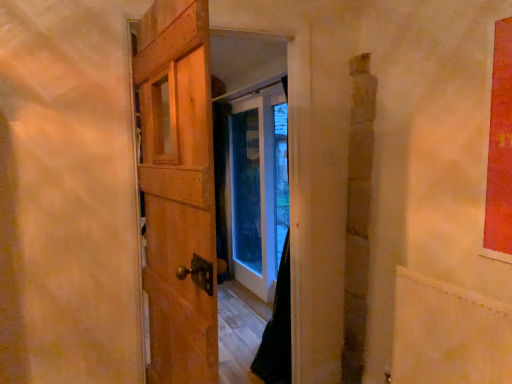
Question: Considering the positions of smooth beige plywood at lower right and wooden door at center in the image, is smooth beige plywood at lower right taller or shorter than wooden door at center?

Choices:
 (A) short
 (B) tall

Answer: (A)

Question: Is point (483, 329) closer or farther from the camera than point (186, 150)?

Choices:
 (A) closer
 (B) farther

Answer: (B)

Question: Is smooth beige plywood at lower right to the left or to the right of wooden door at center in the image?

Choices:
 (A) right
 (B) left

Answer: (A)

Question: Considering the positions of wooden door at center and smooth beige plywood at lower right in the image, is wooden door at center wider or thinner than smooth beige plywood at lower right?

Choices:
 (A) wide
 (B) thin

Answer: (A)

Question: In the image, is wooden door at center on the left side or the right side of smooth beige plywood at lower right?

Choices:
 (A) left
 (B) right

Answer: (A)

Question: Relative to smooth beige plywood at lower right, is wooden door at center in front or behind?

Choices:
 (A) behind
 (B) front

Answer: (B)

Question: From a real-world perspective, is wooden door at center positioned above or below smooth beige plywood at lower right?

Choices:
 (A) above
 (B) below

Answer: (A)